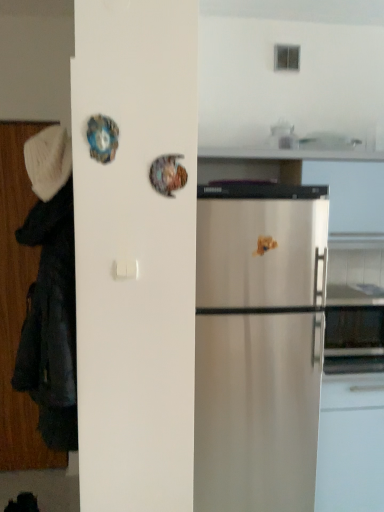
Question: Considering the positions of black fabric coat at left and white knitted hat at left in the image, is black fabric coat at left taller or shorter than white knitted hat at left?

Choices:
 (A) tall
 (B) short

Answer: (A)

Question: Considering their positions, is black fabric coat at left located in front of or behind white knitted hat at left?

Choices:
 (A) behind
 (B) front

Answer: (B)

Question: Is black fabric coat at left inside or outside of white knitted hat at left?

Choices:
 (A) inside
 (B) outside

Answer: (B)

Question: Is white knitted hat at left bigger or smaller than black fabric coat at left?

Choices:
 (A) small
 (B) big

Answer: (A)

Question: Choose the correct answer: Is white knitted hat at left inside black fabric coat at left or outside it?

Choices:
 (A) outside
 (B) inside

Answer: (B)

Question: From the image's perspective, relative to black fabric coat at left, is white knitted hat at left above or below?

Choices:
 (A) above
 (B) below

Answer: (A)

Question: From a real-world perspective, is white knitted hat at left physically located above or below black fabric coat at left?

Choices:
 (A) above
 (B) below

Answer: (A)